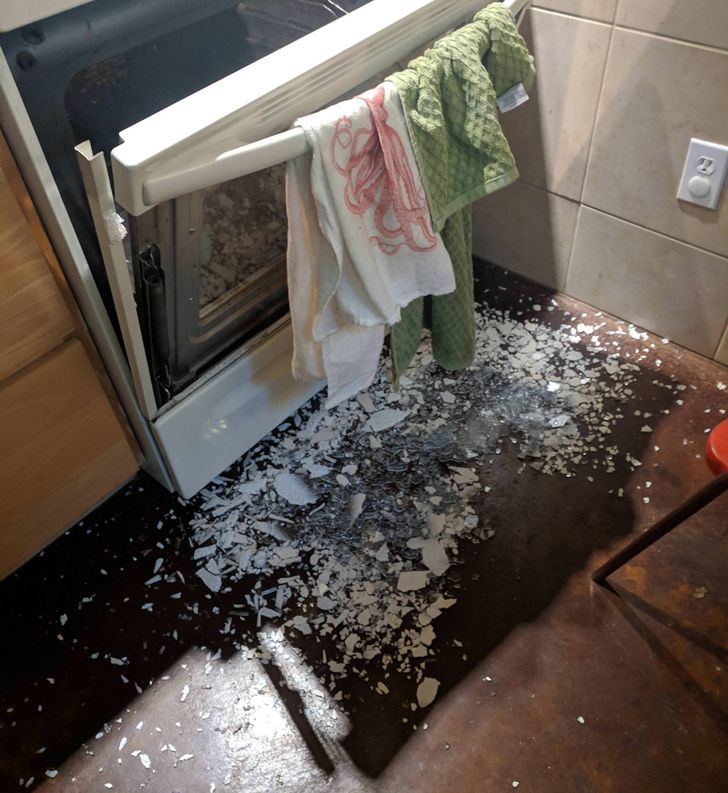
Where is `green towel`? The height and width of the screenshot is (793, 728). green towel is located at coordinates (451, 163), (467, 90), (459, 282), (459, 301).